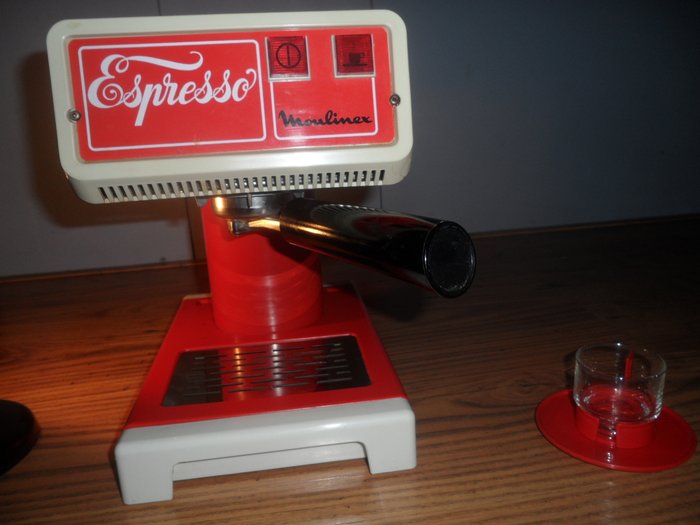
Identify the location of glass. The height and width of the screenshot is (525, 700). (376, 244), (596, 375).